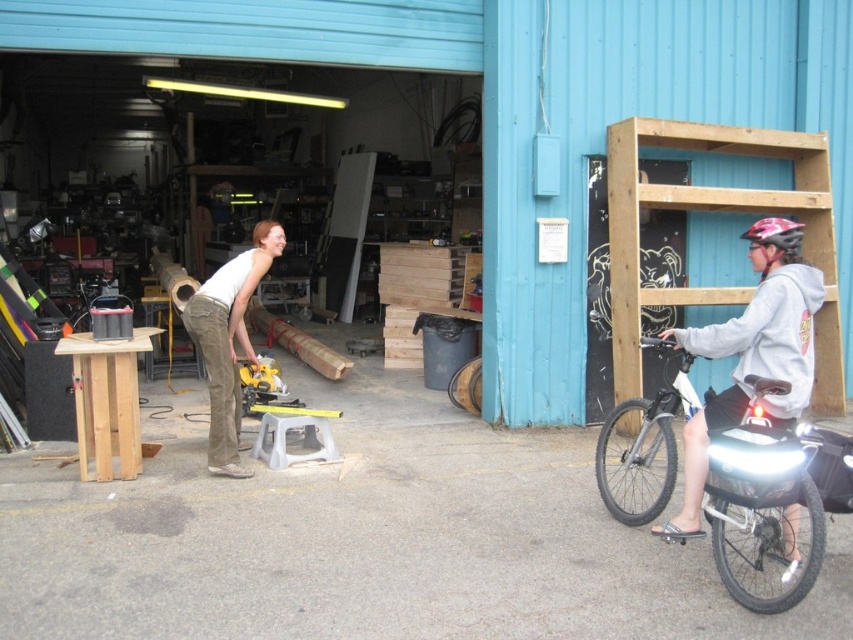
Can you confirm if shiny metallic bicycle at right is positioned to the right of pink matte bicycle helmet at upper right?

Incorrect, shiny metallic bicycle at right is not on the right side of pink matte bicycle helmet at upper right.

Who is more forward, (753, 403) or (775, 234)?

Point (753, 403) is in front.

Locate an element on the screen. shiny metallic bicycle at right is located at coordinates (762, 499).

Can you confirm if white matte shirt at center is wider than pink matte bicycle helmet at upper right?

Yes.

Does point (250, 275) come in front of point (749, 227)?

Yes, it is in front of point (749, 227).

The image size is (853, 640). I want to click on white matte shirt at center, so click(228, 340).

Measure the distance between shiny metallic bicycle at right and white matte shirt at center.

9.83 feet

Is shiny metallic bicycle at right to the right of white matte shirt at center from the viewer's perspective?

Correct, you'll find shiny metallic bicycle at right to the right of white matte shirt at center.

Who is more distant from viewer, (720, 509) or (219, 326)?

Positioned behind is point (219, 326).

Image resolution: width=853 pixels, height=640 pixels. Identify the location of shiny metallic bicycle at right. (762, 499).